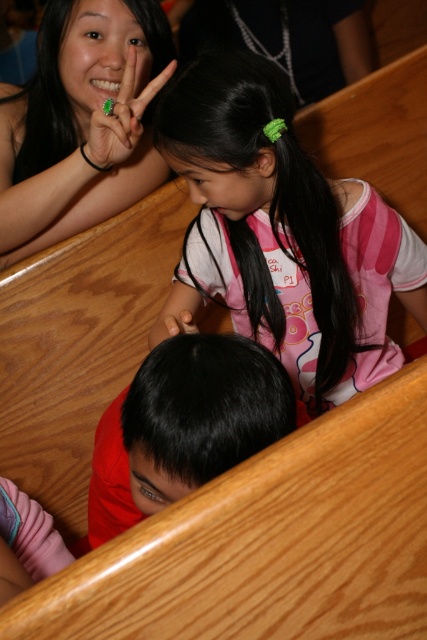
Question: Is pink cotton shirt at center below matte black hand at upper left?

Choices:
 (A) no
 (B) yes

Answer: (B)

Question: Is pink cotton shirt at center to the right of smooth red shirt at lower center from the viewer's perspective?

Choices:
 (A) no
 (B) yes

Answer: (B)

Question: Which point appears farthest from the camera in this image?

Choices:
 (A) (356, 196)
 (B) (157, 88)
 (C) (53, 164)
 (D) (177, 396)

Answer: (C)

Question: Which object appears farthest from the camera in this image?

Choices:
 (A) matte black hand at upper left
 (B) pink cotton shirt at center
 (C) green matte ring at upper left

Answer: (A)

Question: Is matte black hand at upper left to the left of smooth red shirt at lower center from the viewer's perspective?

Choices:
 (A) yes
 (B) no

Answer: (A)

Question: Which object appears farthest from the camera in this image?

Choices:
 (A) matte black hand at upper left
 (B) green matte ring at upper left
 (C) smooth red shirt at lower center
 (D) pink cotton shirt at center

Answer: (A)